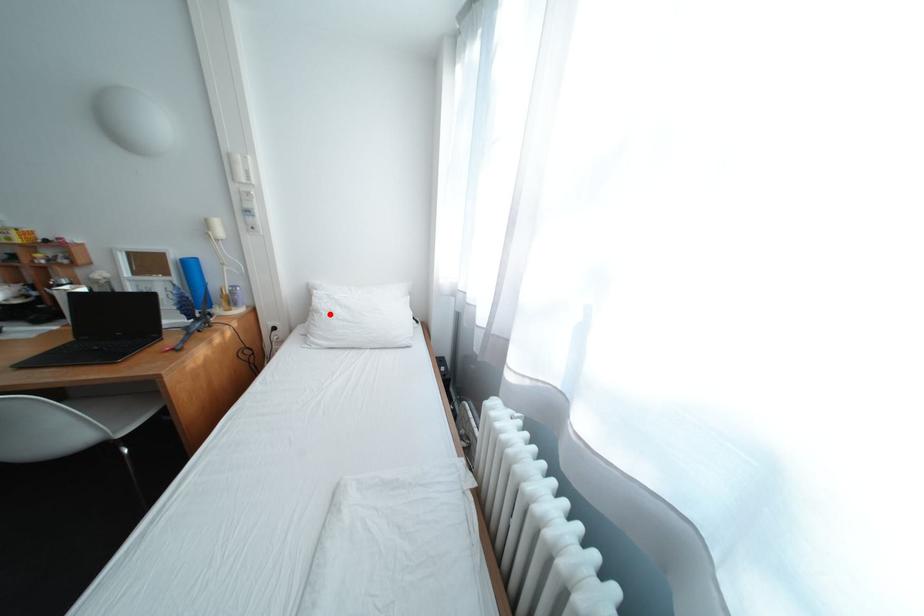
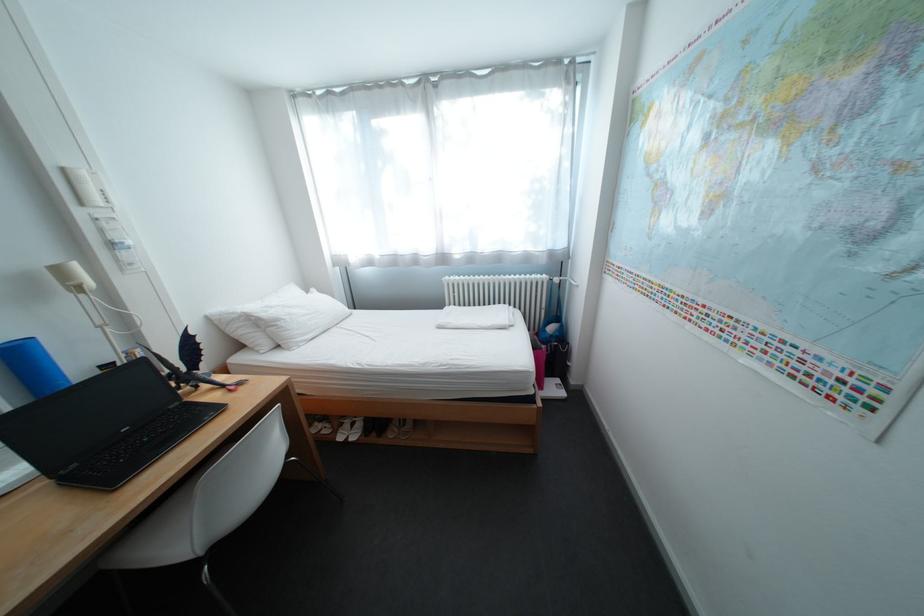
Question: I am providing you with two images of the same scene from different viewpoints. In image1, a red point is highlighted. Considering the same 3D point in image2, which of the following is correct?

Choices:
 (A) It is closer
 (B) It is farther

Answer: (A)